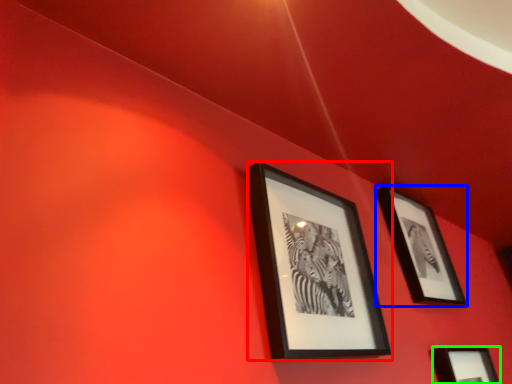
Question: Based on their relative distances, which object is nearer to picture frame (highlighted by a red box)? Choose from picture frame (highlighted by a blue box) and picture frame (highlighted by a green box).

Choices:
 (A) picture frame
 (B) picture frame

Answer: (A)